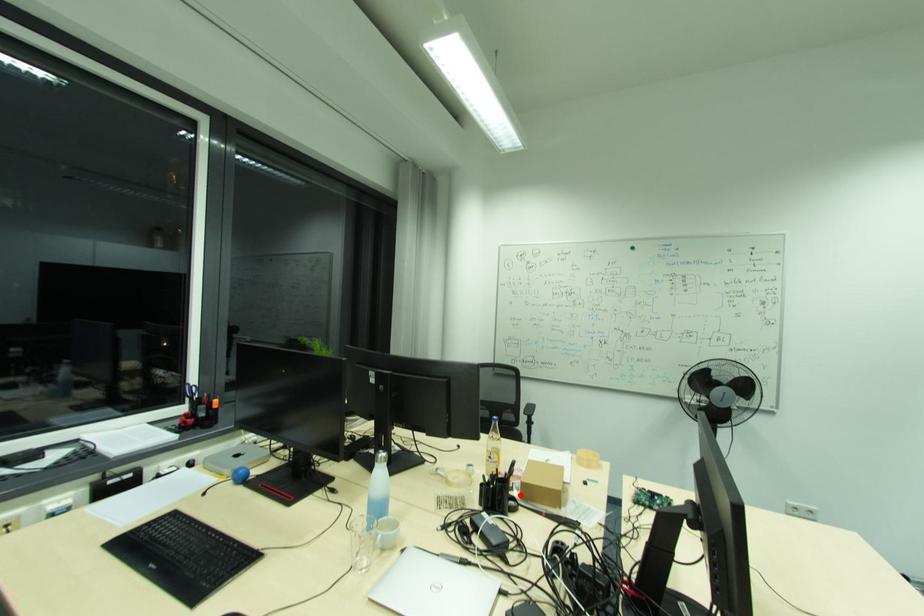
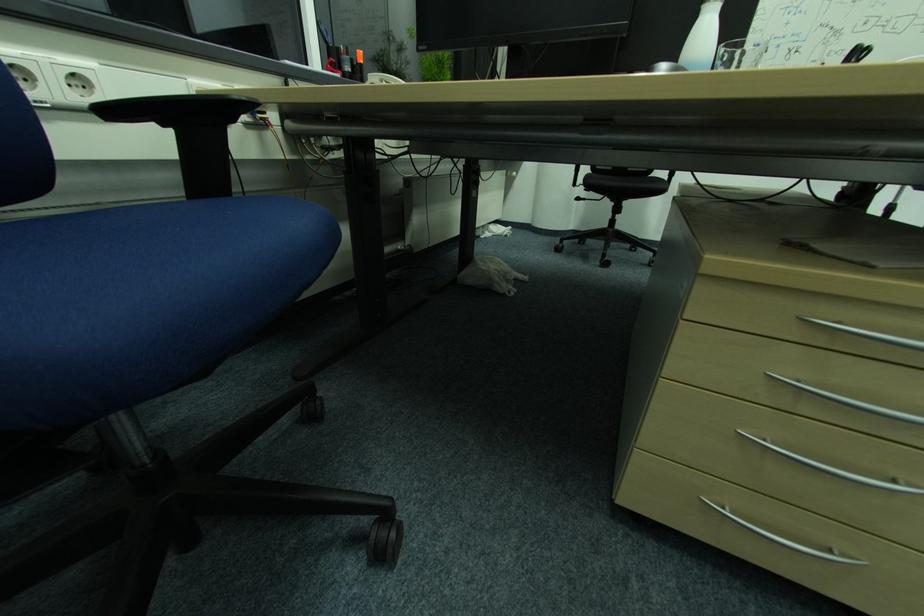
Question: I am providing you with two images of the same scene from different viewpoints. A red point is marked on the first image. At the location where the point appears in image 1, is it still visible in image 2?

Choices:
 (A) Yes
 (B) No

Answer: (B)